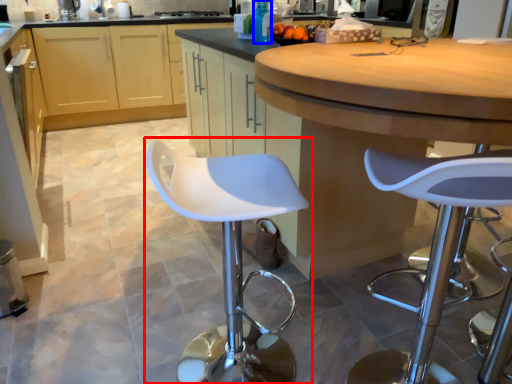
Question: Which object appears closest to the camera in this image, chair (highlighted by a red box) or bottle (highlighted by a blue box)?

Choices:
 (A) chair
 (B) bottle

Answer: (A)